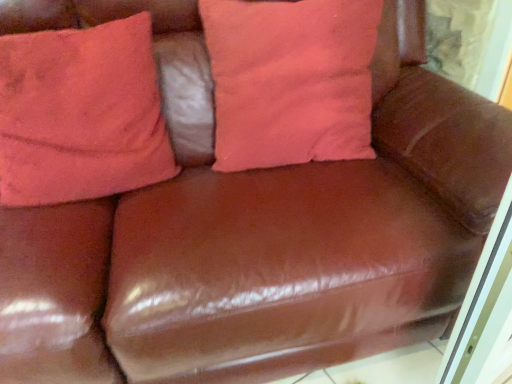
Measure the distance between point (314, 66) and camera.

A distance of 3.57 feet exists between point (314, 66) and camera.

The image size is (512, 384). What do you see at coordinates (290, 80) in the screenshot?
I see `pink cotton pillow at center, the 2th pillow in the left-to-right sequence` at bounding box center [290, 80].

I want to click on pink cotton pillow at center, the 2th pillow in the left-to-right sequence, so click(x=290, y=80).

The image size is (512, 384). I want to click on coral fabric pillow at upper left, which is the 1th pillow from left to right, so click(x=80, y=114).

What do you see at coordinates (80, 114) in the screenshot? The width and height of the screenshot is (512, 384). I see `coral fabric pillow at upper left, marked as the 2th pillow in a right-to-left arrangement` at bounding box center [80, 114].

The width and height of the screenshot is (512, 384). In order to click on pink cotton pillow at center, arranged as the first pillow when viewed from the right in this screenshot , I will do `click(290, 80)`.

Does coral fabric pillow at upper left, which is the 1th pillow from left to right, appear on the left side of pink cotton pillow at center, arranged as the first pillow when viewed from the right?

Indeed, coral fabric pillow at upper left, which is the 1th pillow from left to right, is positioned on the left side of pink cotton pillow at center, arranged as the first pillow when viewed from the right.

Is the depth of coral fabric pillow at upper left, which is the 1th pillow from left to right, less than that of pink cotton pillow at center, the 2th pillow in the left-to-right sequence?

Yes, coral fabric pillow at upper left, which is the 1th pillow from left to right, is in front of pink cotton pillow at center, the 2th pillow in the left-to-right sequence.

Is point (69, 57) positioned behind point (245, 31)?

That is False.

From the image's perspective, which object appears higher, coral fabric pillow at upper left, marked as the 2th pillow in a right-to-left arrangement, or pink cotton pillow at center, the 2th pillow in the left-to-right sequence?

pink cotton pillow at center, the 2th pillow in the left-to-right sequence.

From a real-world perspective, is coral fabric pillow at upper left, marked as the 2th pillow in a right-to-left arrangement, positioned over pink cotton pillow at center, arranged as the first pillow when viewed from the right, based on gravity?

Yes, from a real-world perspective, coral fabric pillow at upper left, marked as the 2th pillow in a right-to-left arrangement, is above pink cotton pillow at center, arranged as the first pillow when viewed from the right.

Looking at their sizes, would you say coral fabric pillow at upper left, marked as the 2th pillow in a right-to-left arrangement, is wider or thinner than pink cotton pillow at center, the 2th pillow in the left-to-right sequence?

Considering their sizes, coral fabric pillow at upper left, marked as the 2th pillow in a right-to-left arrangement, looks slimmer than pink cotton pillow at center, the 2th pillow in the left-to-right sequence.

Considering the sizes of objects coral fabric pillow at upper left, which is the 1th pillow from left to right, and pink cotton pillow at center, the 2th pillow in the left-to-right sequence, in the image provided, who is shorter, coral fabric pillow at upper left, which is the 1th pillow from left to right, or pink cotton pillow at center, the 2th pillow in the left-to-right sequence,?

Standing shorter between the two is pink cotton pillow at center, the 2th pillow in the left-to-right sequence.

Considering the relative sizes of coral fabric pillow at upper left, which is the 1th pillow from left to right, and pink cotton pillow at center, arranged as the first pillow when viewed from the right, in the image provided, is coral fabric pillow at upper left, which is the 1th pillow from left to right, bigger than pink cotton pillow at center, arranged as the first pillow when viewed from the right,?

Incorrect, coral fabric pillow at upper left, which is the 1th pillow from left to right, is not larger than pink cotton pillow at center, arranged as the first pillow when viewed from the right.

From the picture: Is pink cotton pillow at center, the 2th pillow in the left-to-right sequence, located within coral fabric pillow at upper left, marked as the 2th pillow in a right-to-left arrangement?

That's incorrect, pink cotton pillow at center, the 2th pillow in the left-to-right sequence, is not inside coral fabric pillow at upper left, marked as the 2th pillow in a right-to-left arrangement.

Would you consider coral fabric pillow at upper left, which is the 1th pillow from left to right, to be distant from pink cotton pillow at center, the 2th pillow in the left-to-right sequence?

They are positioned close to each other.

Is coral fabric pillow at upper left, which is the 1th pillow from left to right, facing away from pink cotton pillow at center, arranged as the first pillow when viewed from the right?

No, coral fabric pillow at upper left, which is the 1th pillow from left to right,'s orientation is not away from pink cotton pillow at center, arranged as the first pillow when viewed from the right.

Find the location of a particular element. The image size is (512, 384). pillow that is behind the coral fabric pillow at upper left, which is the 1th pillow from left to right is located at coordinates (290, 80).

Is pink cotton pillow at center, the 2th pillow in the left-to-right sequence, to the left or to the right of coral fabric pillow at upper left, marked as the 2th pillow in a right-to-left arrangement, in the image?

In the image, pink cotton pillow at center, the 2th pillow in the left-to-right sequence, appears on the right side of coral fabric pillow at upper left, marked as the 2th pillow in a right-to-left arrangement.

Which object is further away from the camera, pink cotton pillow at center, arranged as the first pillow when viewed from the right, or coral fabric pillow at upper left, marked as the 2th pillow in a right-to-left arrangement?

pink cotton pillow at center, arranged as the first pillow when viewed from the right, is more distant.

Is point (271, 58) in front of point (83, 157)?

No, it is not.

From the image's perspective, is pink cotton pillow at center, the 2th pillow in the left-to-right sequence, under coral fabric pillow at upper left, marked as the 2th pillow in a right-to-left arrangement?

Incorrect, from the image's perspective, pink cotton pillow at center, the 2th pillow in the left-to-right sequence, is higher than coral fabric pillow at upper left, marked as the 2th pillow in a right-to-left arrangement.

From a real-world perspective, relative to coral fabric pillow at upper left, marked as the 2th pillow in a right-to-left arrangement, is pink cotton pillow at center, arranged as the first pillow when viewed from the right, vertically above or below?

In terms of real-world spatial position, pink cotton pillow at center, arranged as the first pillow when viewed from the right, is below coral fabric pillow at upper left, marked as the 2th pillow in a right-to-left arrangement.

Is pink cotton pillow at center, arranged as the first pillow when viewed from the right, wider than coral fabric pillow at upper left, which is the 1th pillow from left to right?

Indeed, pink cotton pillow at center, arranged as the first pillow when viewed from the right, has a greater width compared to coral fabric pillow at upper left, which is the 1th pillow from left to right.

Considering the sizes of pink cotton pillow at center, arranged as the first pillow when viewed from the right, and coral fabric pillow at upper left, which is the 1th pillow from left to right, in the image, is pink cotton pillow at center, arranged as the first pillow when viewed from the right, taller or shorter than coral fabric pillow at upper left, which is the 1th pillow from left to right,?

Clearly, pink cotton pillow at center, arranged as the first pillow when viewed from the right, is shorter compared to coral fabric pillow at upper left, which is the 1th pillow from left to right.

Which of these two, pink cotton pillow at center, arranged as the first pillow when viewed from the right, or coral fabric pillow at upper left, marked as the 2th pillow in a right-to-left arrangement, is smaller?

With smaller size is coral fabric pillow at upper left, marked as the 2th pillow in a right-to-left arrangement.

Would you say pink cotton pillow at center, arranged as the first pillow when viewed from the right, is inside or outside coral fabric pillow at upper left, marked as the 2th pillow in a right-to-left arrangement?

pink cotton pillow at center, arranged as the first pillow when viewed from the right, is not inside coral fabric pillow at upper left, marked as the 2th pillow in a right-to-left arrangement, it's outside.

Are pink cotton pillow at center, arranged as the first pillow when viewed from the right, and coral fabric pillow at upper left, marked as the 2th pillow in a right-to-left arrangement, located far from each other?

No.

Is pink cotton pillow at center, the 2th pillow in the left-to-right sequence, looking in the opposite direction of coral fabric pillow at upper left, which is the 1th pillow from left to right?

No, pink cotton pillow at center, the 2th pillow in the left-to-right sequence, is not facing the opposite direction of coral fabric pillow at upper left, which is the 1th pillow from left to right.

What's the angular difference between pink cotton pillow at center, arranged as the first pillow when viewed from the right, and coral fabric pillow at upper left, which is the 1th pillow from left to right,'s facing directions?

1.98 degrees.

This screenshot has height=384, width=512. Find the location of `pillow lying on the right of coral fabric pillow at upper left, which is the 1th pillow from left to right`. pillow lying on the right of coral fabric pillow at upper left, which is the 1th pillow from left to right is located at coordinates (290, 80).

Where is `pillow above the pink cotton pillow at center, the 2th pillow in the left-to-right sequence (from a real-world perspective)`? pillow above the pink cotton pillow at center, the 2th pillow in the left-to-right sequence (from a real-world perspective) is located at coordinates (80, 114).

Identify the location of pillow that appears in front of the pink cotton pillow at center, the 2th pillow in the left-to-right sequence. (80, 114).